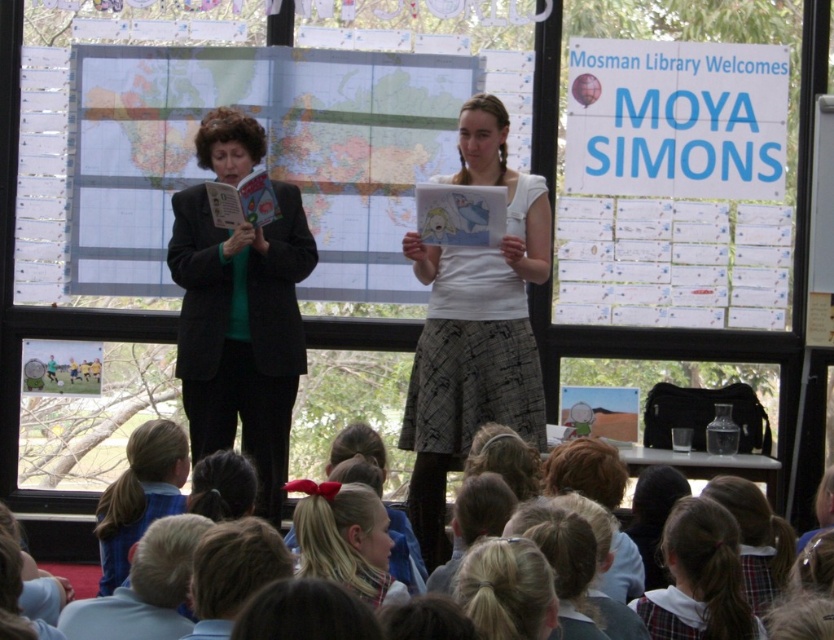
Can you confirm if black fabric jacket at left is shorter than white cotton shirt at center?

Yes, black fabric jacket at left is shorter than white cotton shirt at center.

From the picture: Does black fabric jacket at left appear on the left side of white cotton shirt at center?

Indeed, black fabric jacket at left is positioned on the left side of white cotton shirt at center.

This screenshot has width=834, height=640. Identify the location of black fabric jacket at left. (240, 332).

Who is positioned more to the left, map paper at center or blue fabric at lower left?

blue fabric at lower left

Can you confirm if map paper at center is shorter than blue fabric at lower left?

Incorrect, map paper at center's height does not fall short of blue fabric at lower left's.

Describe the element at coordinates (265, 156) in the screenshot. I see `map paper at center` at that location.

Identify the location of map paper at center. (265, 156).

Which is below, black fabric jacket at left or light blue shirt at lower left?

light blue shirt at lower left

Does black fabric jacket at left have a greater height compared to light blue shirt at lower left?

Yes.

Is point (234, 388) closer to viewer compared to point (171, 560)?

No, (234, 388) is behind (171, 560).

Identify the location of black fabric jacket at left. Image resolution: width=834 pixels, height=640 pixels. (240, 332).